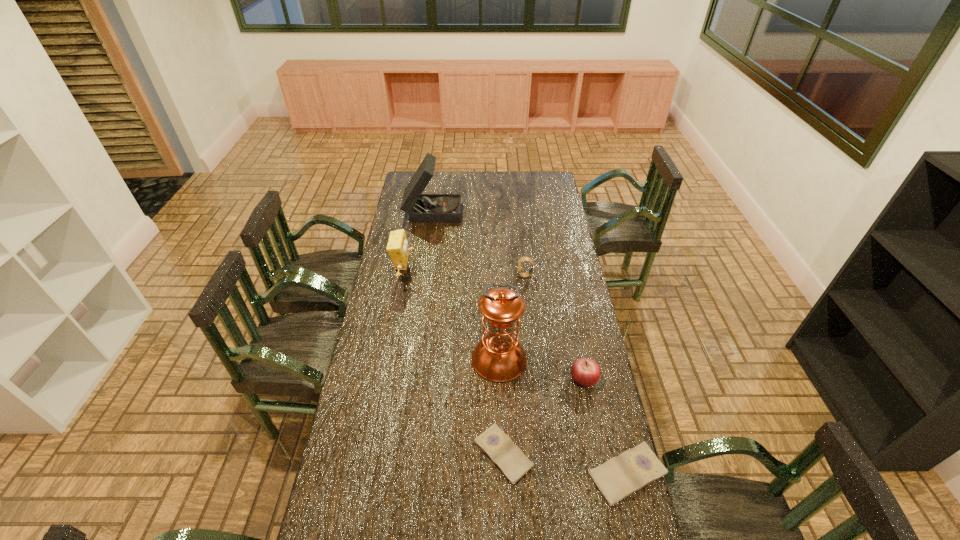
The width and height of the screenshot is (960, 540). I want to click on sponge situated at the left edge, so click(x=397, y=247).

Identify the location of diary situated at the right edge. The height and width of the screenshot is (540, 960). (620, 476).

What are the coordinates of `apple at the right edge` in the screenshot? It's located at (585, 372).

Find the location of `blank space at the far edge of the desktop`. blank space at the far edge of the desktop is located at coordinates (527, 181).

Locate an element on the screen. The width and height of the screenshot is (960, 540). blank area at the near edge is located at coordinates [442, 514].

Locate an element on the screen. The height and width of the screenshot is (540, 960). blank space at the left edge of the desktop is located at coordinates (348, 428).

The height and width of the screenshot is (540, 960). I want to click on vacant space at the right edge of the desktop, so click(x=568, y=355).

I want to click on vacant space at the far right corner, so click(538, 181).

The width and height of the screenshot is (960, 540). In order to click on free space between the shorter diary and the farthest object in this screenshot , I will do `click(468, 332)`.

You are a GUI agent. You are given a task and a screenshot of the screen. Output one action in this format:
    pyautogui.click(x=<x>, y=<y>)
    Task: Click on the free space between the phonograph_record and the oil lamp
    
    Given the screenshot: What is the action you would take?
    pyautogui.click(x=467, y=285)